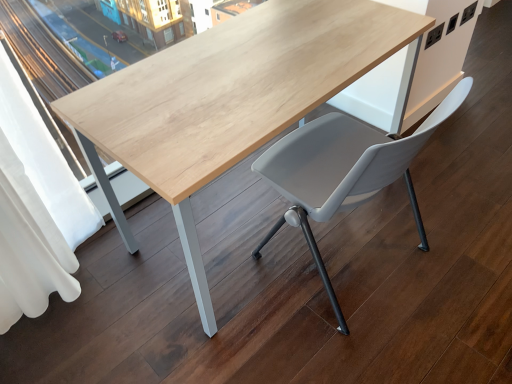
Identify the location of vacant area in front of matte gray plastic chair at center. (342, 343).